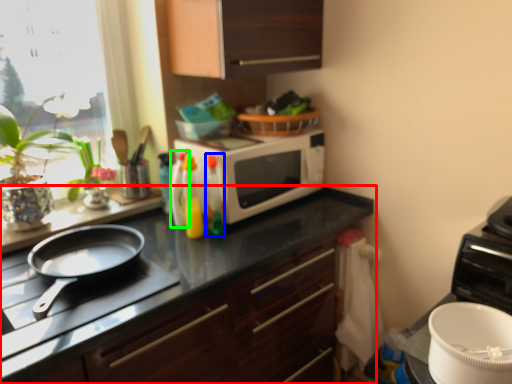
Question: Considering the real-world distances, which object is closest to cabinetry (highlighted by a red box)? bottle (highlighted by a blue box) or bottle (highlighted by a green box).

Choices:
 (A) bottle
 (B) bottle

Answer: (A)